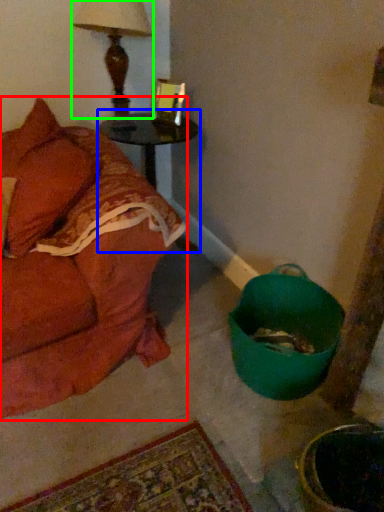
Question: Estimate the real-world distances between objects in this image. Which object is closer to studio couch (highlighted by a red box), table (highlighted by a blue box) or table lamp (highlighted by a green box)?

Choices:
 (A) table
 (B) table lamp

Answer: (A)